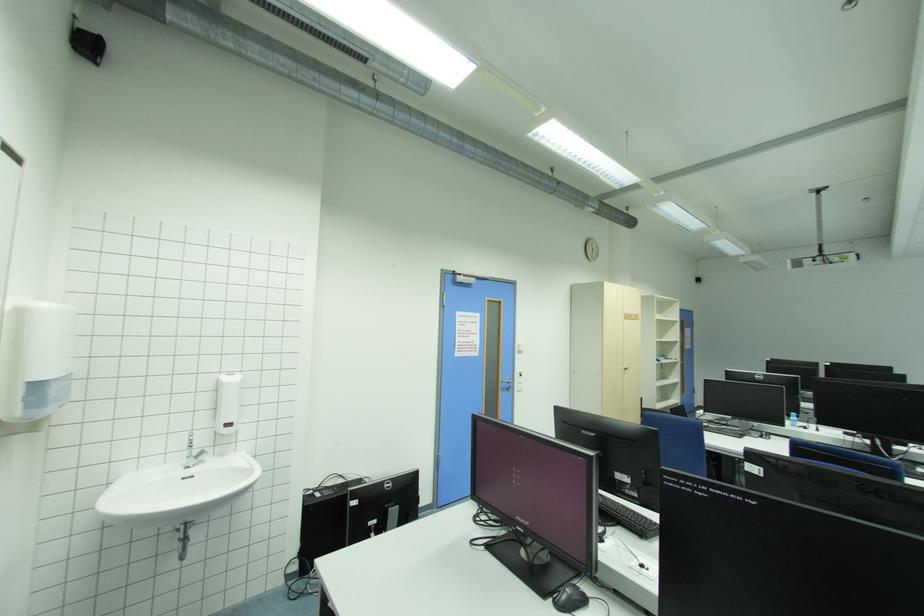
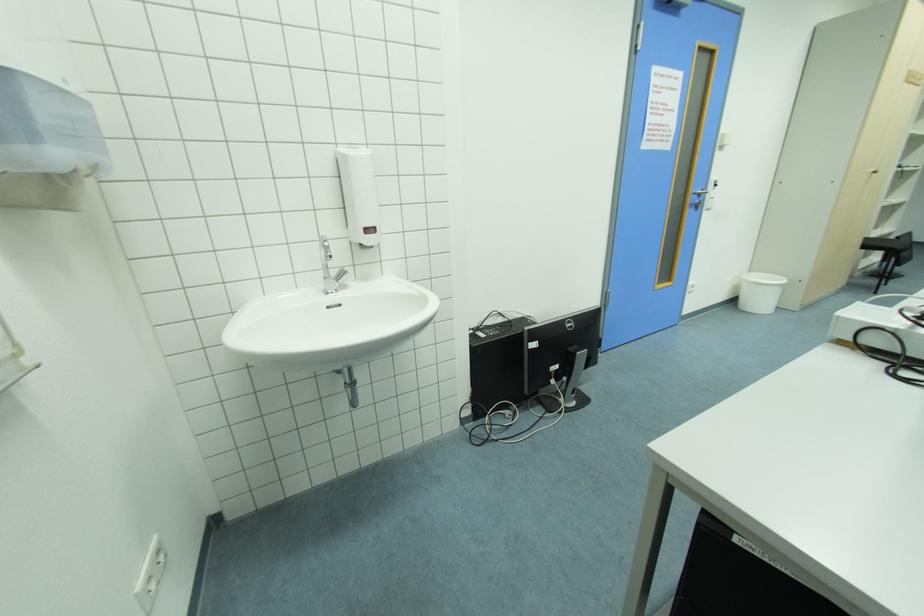
In the second image, find the point that corresponds to pixel 235 426 in the first image.

(375, 232)